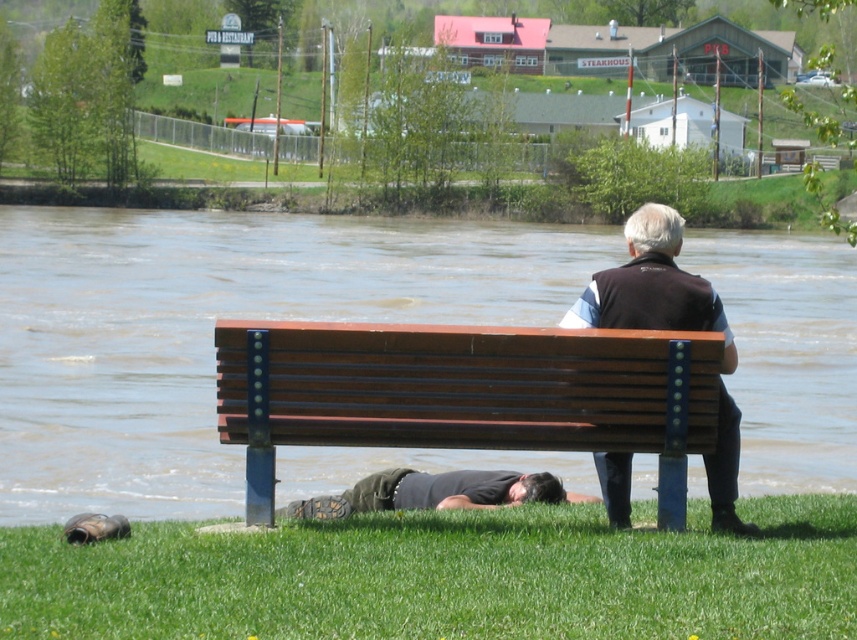
You are a park visitor who wants to sit on the brown wooden bench at center. However, there is a dark gray fabric shirt at lower center in the way. Can you sit on the bench without moving the shirt?

The brown wooden bench at center is positioned over dark gray fabric shirt at lower center, meaning the shirt is beneath the bench. Since the shirt is under the bench, you can sit on the bench without needing to move the shirt as it is already underneath.

You are a photographer positioned at the riverside scene. You want to capture a photo of both the dark brown leather jacket at center and the dark gray fabric shirt at lower center without any obstruction. Based on their positions, which object should you focus on first to ensure both are in frame?

You should focus on the dark brown leather jacket at center first since it is closer to you than the dark gray fabric shirt at lower center, ensuring both are in frame by adjusting the camera angle accordingly.